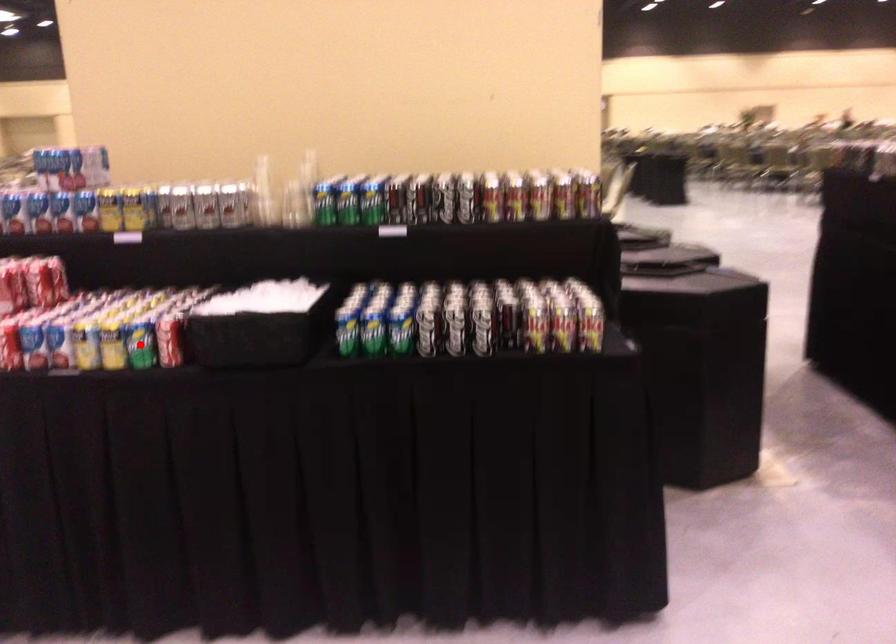
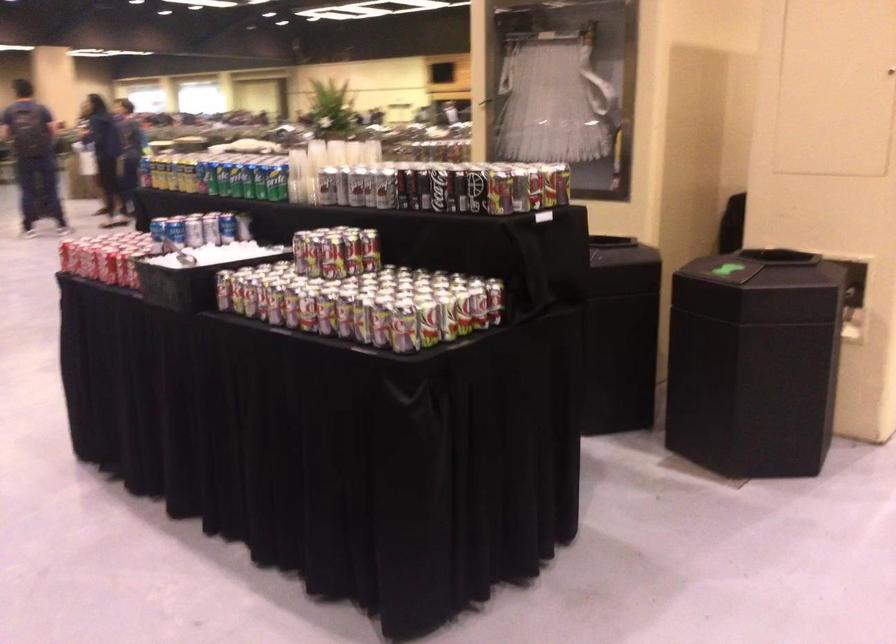
Question: I am providing you with two images of the same scene from different viewpoints. A red point is marked on the first image. Can you still see the location of the red point in image 2?

Choices:
 (A) Yes
 (B) No

Answer: (B)